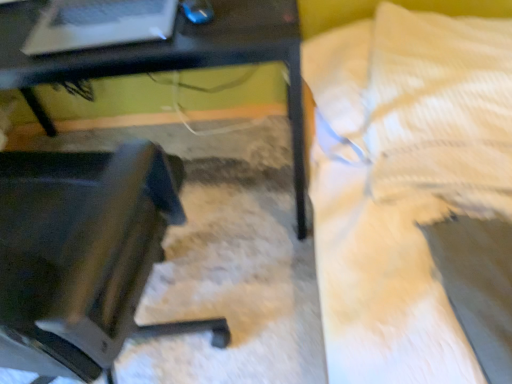
Question: From a real-world perspective, is black plastic table at center on black plastic chair at lower left?

Choices:
 (A) no
 (B) yes

Answer: (B)

Question: Is black plastic chair at lower left surrounded by black plastic table at center?

Choices:
 (A) yes
 (B) no

Answer: (B)

Question: Does black plastic table at center have a greater width compared to black plastic chair at lower left?

Choices:
 (A) no
 (B) yes

Answer: (A)

Question: Is black plastic table at center at the right side of black plastic chair at lower left?

Choices:
 (A) no
 (B) yes

Answer: (A)

Question: Considering the relative sizes of black plastic table at center and black plastic chair at lower left in the image provided, is black plastic table at center shorter than black plastic chair at lower left?

Choices:
 (A) yes
 (B) no

Answer: (B)

Question: Is black plastic table at center thinner than black plastic chair at lower left?

Choices:
 (A) no
 (B) yes

Answer: (B)

Question: Is white textured pillow at upper right looking in the opposite direction of black plastic chair at lower left?

Choices:
 (A) yes
 (B) no

Answer: (B)

Question: Is white textured pillow at upper right at the left side of black plastic chair at lower left?

Choices:
 (A) yes
 (B) no

Answer: (B)

Question: Does white textured pillow at upper right have a larger size compared to black plastic chair at lower left?

Choices:
 (A) yes
 (B) no

Answer: (B)

Question: Does white textured pillow at upper right have a greater width compared to black plastic chair at lower left?

Choices:
 (A) no
 (B) yes

Answer: (A)

Question: Does white textured pillow at upper right have a smaller size compared to black plastic chair at lower left?

Choices:
 (A) yes
 (B) no

Answer: (A)

Question: Does white textured pillow at upper right lie behind black plastic chair at lower left?

Choices:
 (A) yes
 (B) no

Answer: (B)

Question: From the image's perspective, is matte black laptop at upper left on top of black plastic chair at lower left?

Choices:
 (A) no
 (B) yes

Answer: (B)